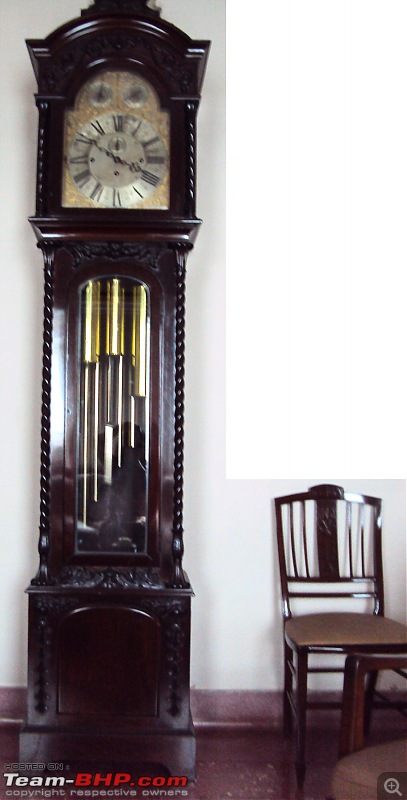
In order to click on baseboard in this screenshot , I will do `click(233, 708)`.